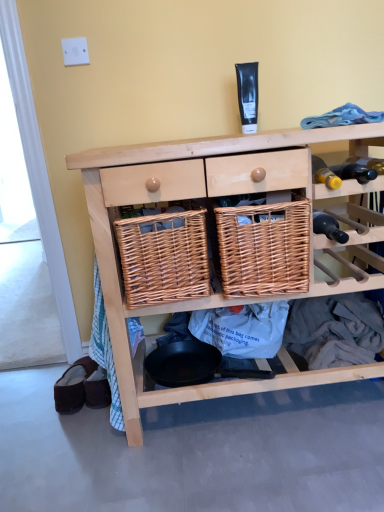
Question: Looking at the image, does natural wood wicker baskets at center seem bigger or smaller compared to brown suede slippers at lower left?

Choices:
 (A) big
 (B) small

Answer: (A)

Question: Is point (155, 175) positioned closer to the camera than point (72, 384)?

Choices:
 (A) closer
 (B) farther

Answer: (A)

Question: Estimate the real-world distances between objects in this image. Which object is closer to the natural wood wicker baskets at center?

Choices:
 (A) woven brown basket at center, which is counted as the second basket, starting from the left
 (B) black matte tube at upper center
 (C) brown suede slippers at lower left
 (D) woven brown basket at center, the 2th basket viewed from the right
 (E) black glass bottle at right

Answer: (A)

Question: Which of these objects is positioned closest to the woven brown basket at center, the 2th basket viewed from the right?

Choices:
 (A) brown suede slippers at lower left
 (B) natural wood wicker baskets at center
 (C) black matte tube at upper center
 (D) woven brown basket at center, which is counted as the second basket, starting from the left
 (E) black glass bottle at right

Answer: (D)